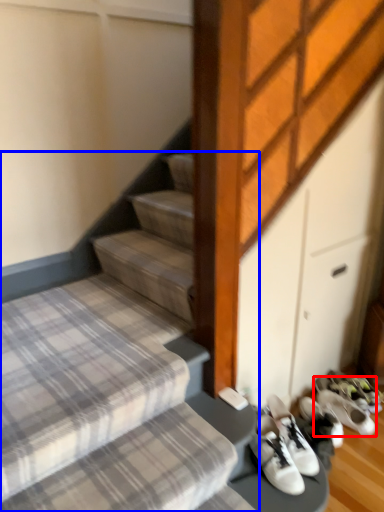
Question: Which object is closer to the camera taking this photo, footwear (highlighted by a red box) or stairs (highlighted by a blue box)?

Choices:
 (A) footwear
 (B) stairs

Answer: (B)